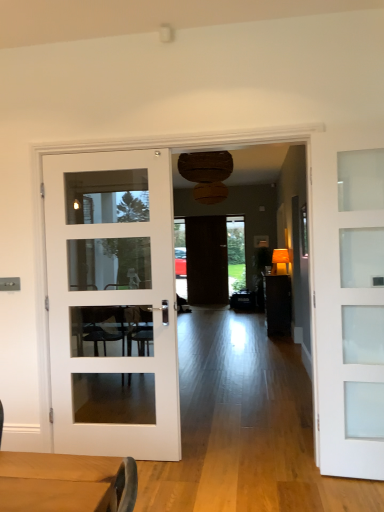
Image resolution: width=384 pixels, height=512 pixels. Identify the location of blank space above white glass door at left, arranged as the second door when viewed from the back (from a real-world perspective). (109, 150).